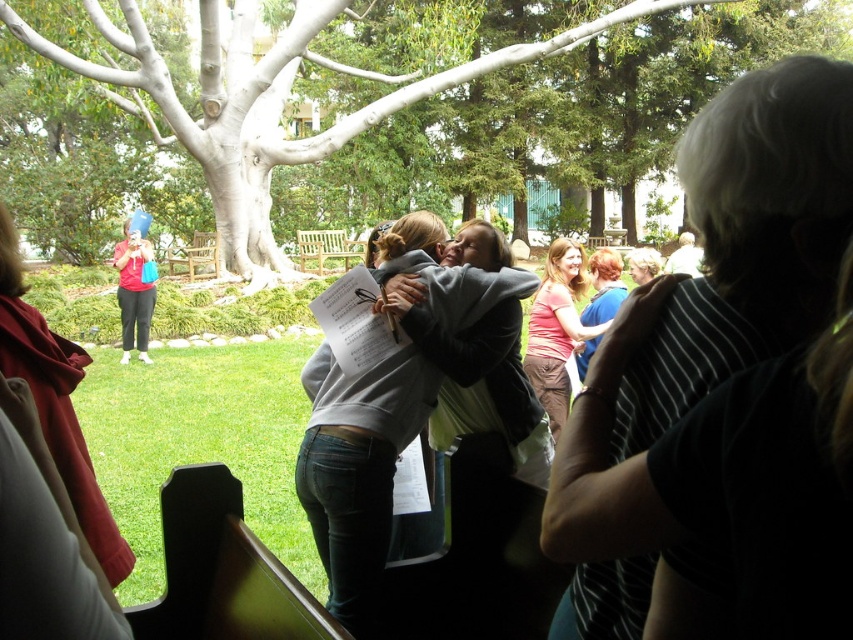
You are standing at the center of the park and want to take a photo of the white textured tree at center. Which direction should you face to ensure the tree is in the center of your camera view?

The white textured tree at center is located at point coordinates of (445,83), so you should face towards the left side of the park to center it in your camera view.

You are at a park event and see two people interacting. The gray sweatshirt at center and the pink fabric shirt at center are both visible. Which one is positioned more to the left?

The gray sweatshirt at center is positioned more to the left than the pink fabric shirt at center.